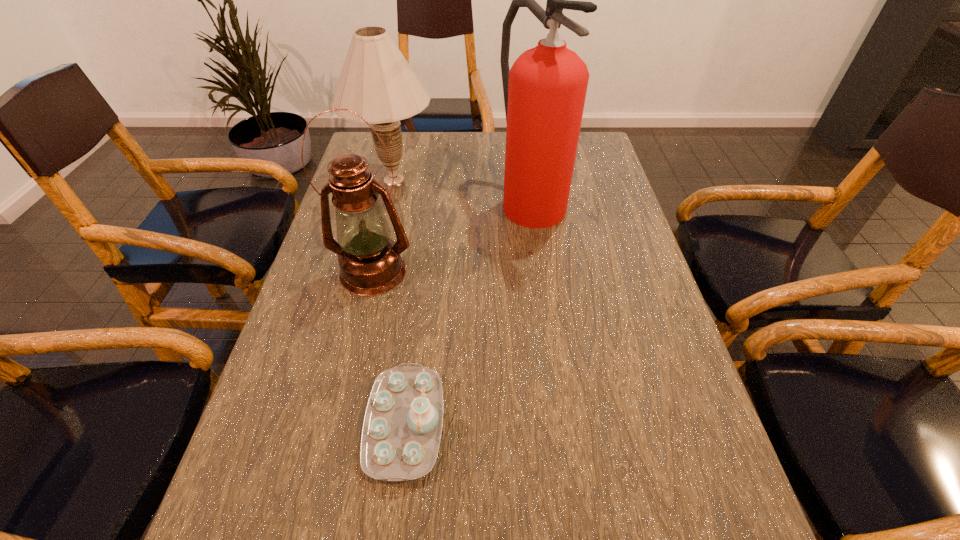
Identify the location of free spot between the second nearest object and the nearest object. The image size is (960, 540). (389, 348).

Find the location of a particular element. The height and width of the screenshot is (540, 960). free spot between the shortest object and the tallest object is located at coordinates pyautogui.click(x=468, y=312).

Locate an element on the screen. The height and width of the screenshot is (540, 960). vacant area between the shortest object and the oil lamp is located at coordinates (389, 348).

Find the location of a particular element. This screenshot has height=540, width=960. empty location between the shortest object and the rightmost object is located at coordinates (468, 312).

Identify the location of vacant space in between the nearest object and the fire extinguisher. (468, 312).

Image resolution: width=960 pixels, height=540 pixels. Identify the location of object that is the closest to the tallest object. 376,82.

This screenshot has width=960, height=540. I want to click on object that ranks as the second closest to the nearest object, so click(x=544, y=91).

At what (x,y) coordinates should I click in order to perform the action: click on free space in the image that satisfies the following two spatial constraints: 1. on the front side of the lampshade; 2. on the left side of the shortest object. Please return your answer as a coordinate pair (x, y). Looking at the image, I should click on (336, 424).